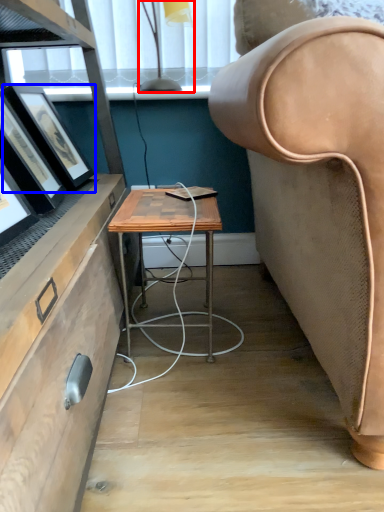
Question: Among these objects, which one is nearest to the camera, lamp (highlighted by a red box) or picture frame (highlighted by a blue box)?

Choices:
 (A) lamp
 (B) picture frame

Answer: (B)